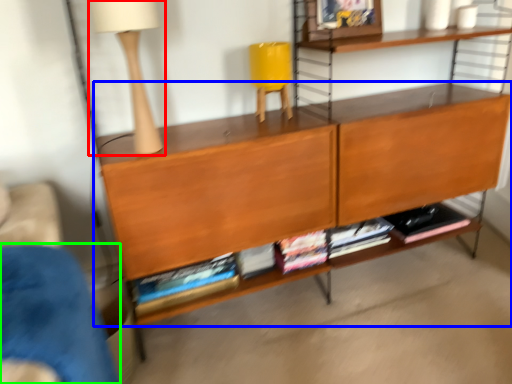
Question: Based on their relative distances, which object is farther from table lamp (highlighted by a red box)? Choose from shelf (highlighted by a blue box) and armchair (highlighted by a green box).

Choices:
 (A) shelf
 (B) armchair

Answer: (B)